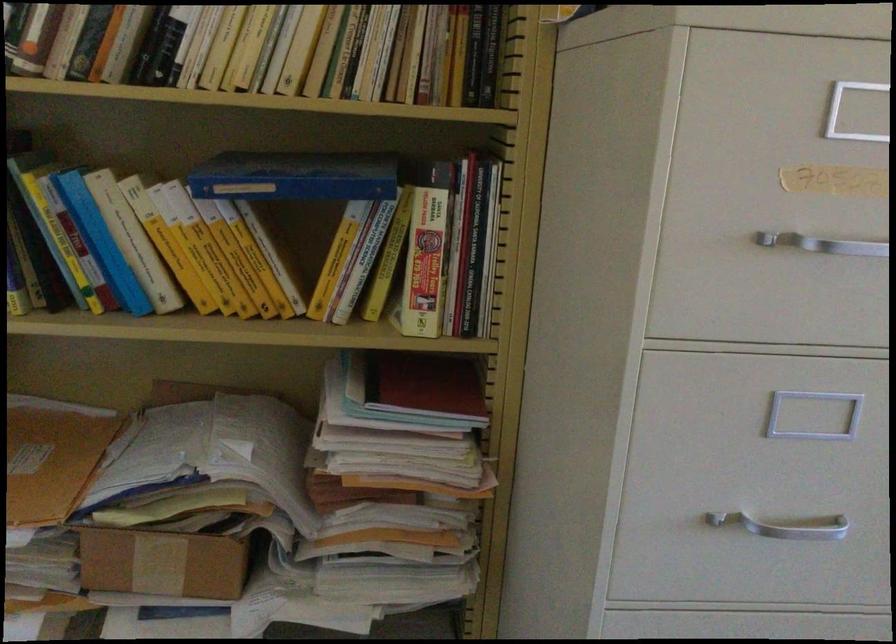
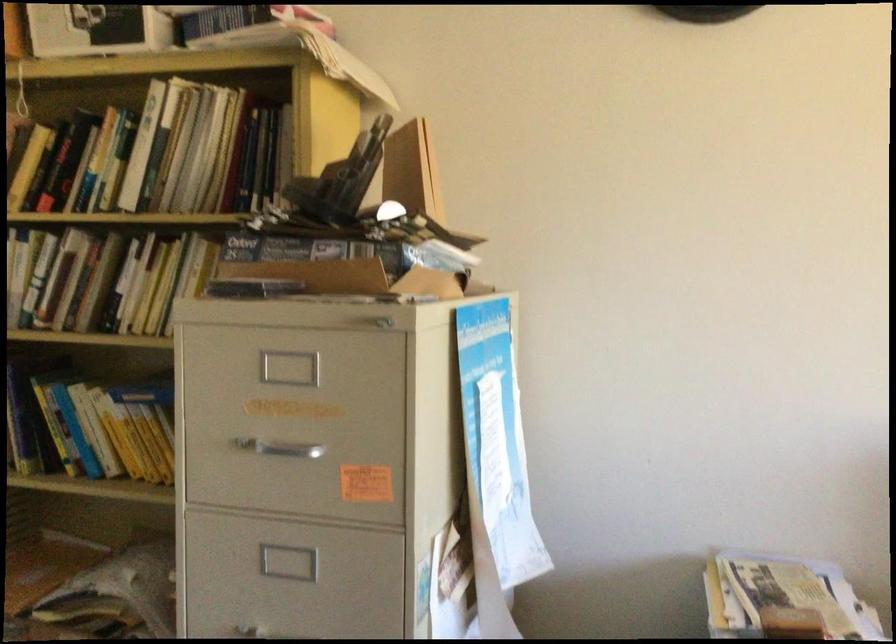
Question: The camera is either moving clockwise (left) or counter-clockwise (right) around the object. The first image is from the beginning of the video and the second image is from the end. Is the camera moving left or right when shooting the video?

Choices:
 (A) Left
 (B) Right

Answer: (B)